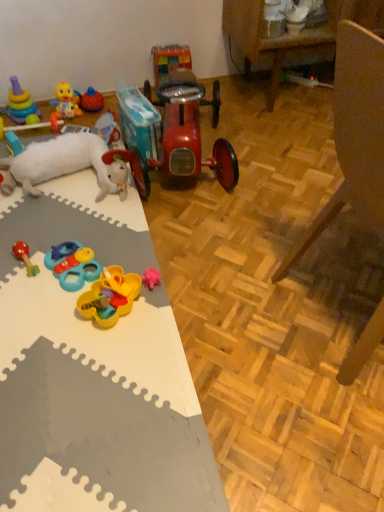
Where is `vacant space situated on the left part of wooden armchair at lower right`? vacant space situated on the left part of wooden armchair at lower right is located at coordinates (227, 313).